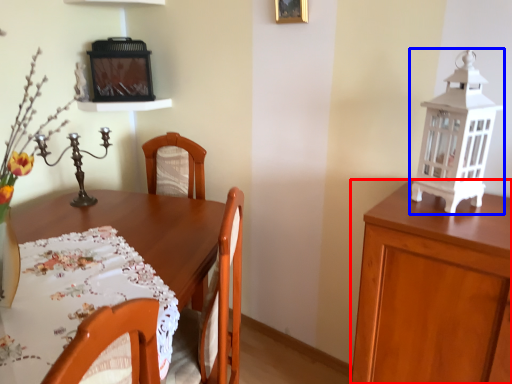
Question: Which object is closer to the camera taking this photo, cabinetry (highlighted by a red box) or lantern (highlighted by a blue box)?

Choices:
 (A) cabinetry
 (B) lantern

Answer: (A)